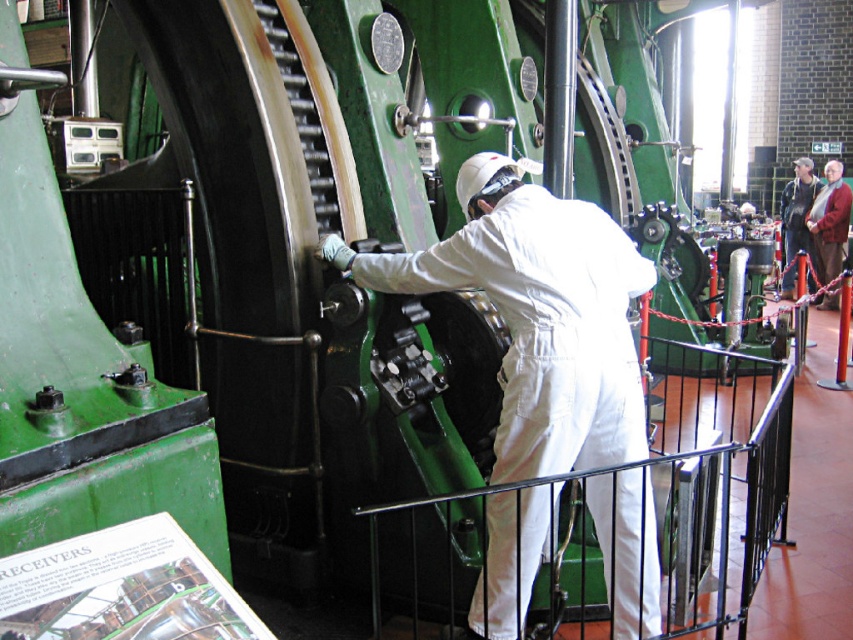
Who is more forward, (543,257) or (792,204)?

Point (543,257) is more forward.

Which is more to the right, white matte coveralls at center or dark brown leather robe at upper right?

Positioned to the right is dark brown leather robe at upper right.

Who is more forward, (503,524) or (793,228)?

Point (503,524)

Locate an element on the screen. The image size is (853, 640). white matte coveralls at center is located at coordinates (537, 314).

Can you confirm if red woolen robe at right is taller than dark brown leather robe at upper right?

In fact, red woolen robe at right may be shorter than dark brown leather robe at upper right.

Is red woolen robe at right to the left of dark brown leather robe at upper right from the viewer's perspective?

Correct, you'll find red woolen robe at right to the left of dark brown leather robe at upper right.

Is point (817, 234) closer to viewer compared to point (804, 188)?

That is True.

Where is `red woolen robe at right`? The height and width of the screenshot is (640, 853). red woolen robe at right is located at coordinates (831, 228).

Does white matte coveralls at center appear over red woolen robe at right?

No, white matte coveralls at center is not above red woolen robe at right.

Does point (509, 544) come closer to viewer compared to point (815, 252)?

Yes, it is.

The image size is (853, 640). I want to click on white matte coveralls at center, so click(537, 314).